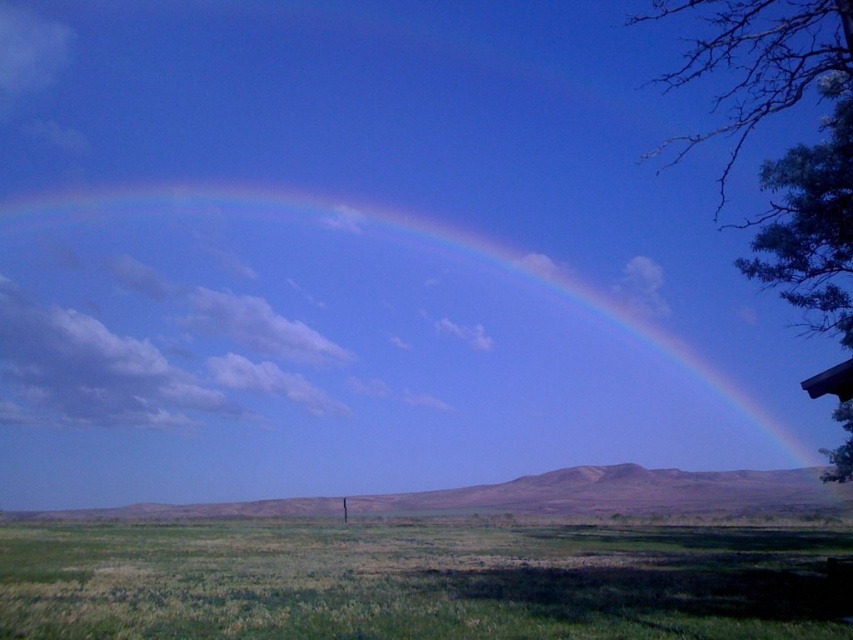
Consider the image. Can you confirm if rainbow at upper center is wider than green grassy field at lower center?

Indeed, rainbow at upper center has a greater width compared to green grassy field at lower center.

What are the coordinates of `rainbow at upper center` in the screenshot? It's located at (358, 349).